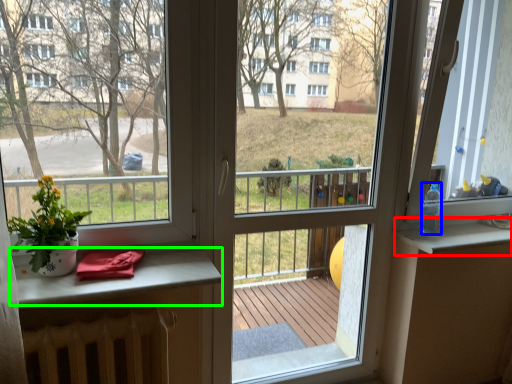
Question: Which object is the closest to the window sill (highlighted by a red box)? Choose among these: bottle (highlighted by a blue box) or table (highlighted by a green box).

Choices:
 (A) bottle
 (B) table

Answer: (A)